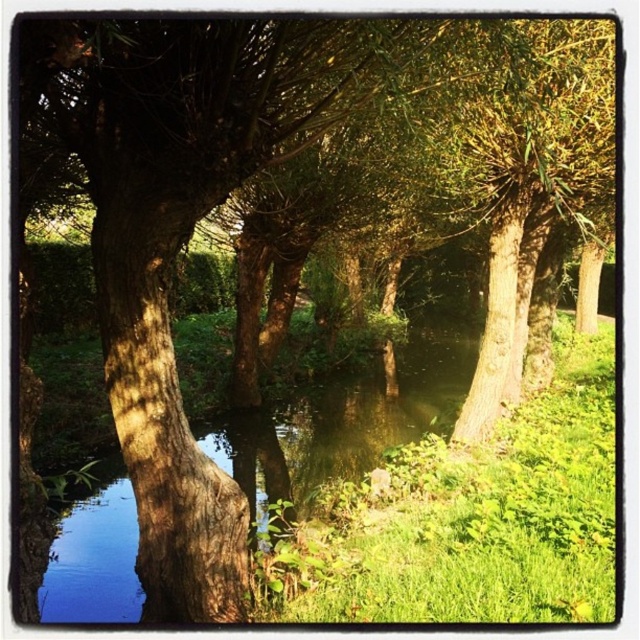
Does point (346, 492) come closer to viewer compared to point (259, 497)?

Yes, it is in front of point (259, 497).

Is point (326, 552) closer to viewer compared to point (433, 364)?

Yes, it is.

This screenshot has height=640, width=640. In order to click on green leafy grass at center in this screenshot , I will do `click(476, 515)`.